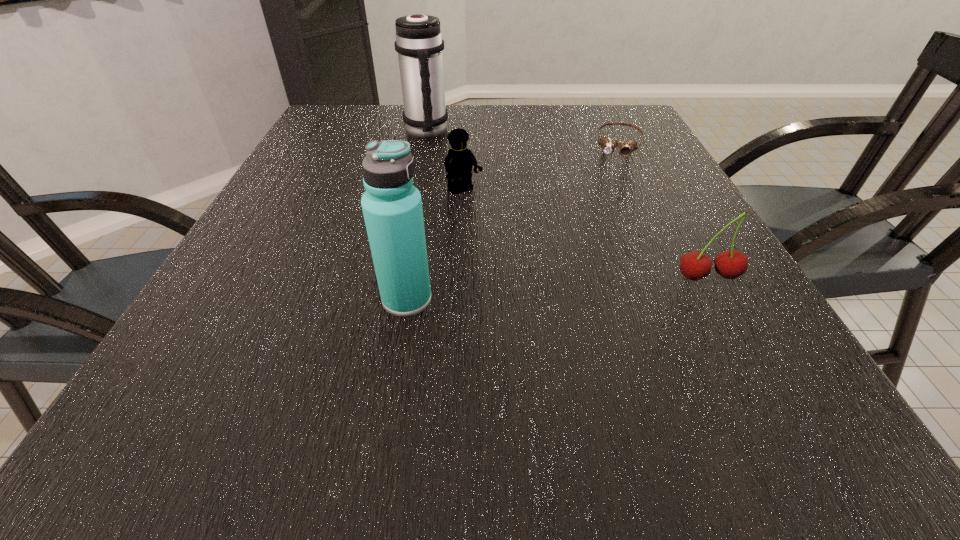
At what (x,y) coordinates should I click in order to perform the action: click on vacant space on the desktop that is between the nearer thermos bottle and the cherry and is positioned on the side with the handle of the farther thermos bottle. Please return your answer as a coordinate pair (x, y). Looking at the image, I should click on (550, 289).

Find the location of `vacant space on the desktop that is between the nearer thermos bottle and the cherry and is positioned on the front lenses and sides of the goggles`. vacant space on the desktop that is between the nearer thermos bottle and the cherry and is positioned on the front lenses and sides of the goggles is located at coordinates (589, 286).

Where is `vacant space on the desktop that is between the nearer thermos bottle and the cherry and is positioned on the front-facing side of the Lego`? Image resolution: width=960 pixels, height=540 pixels. vacant space on the desktop that is between the nearer thermos bottle and the cherry and is positioned on the front-facing side of the Lego is located at coordinates (554, 288).